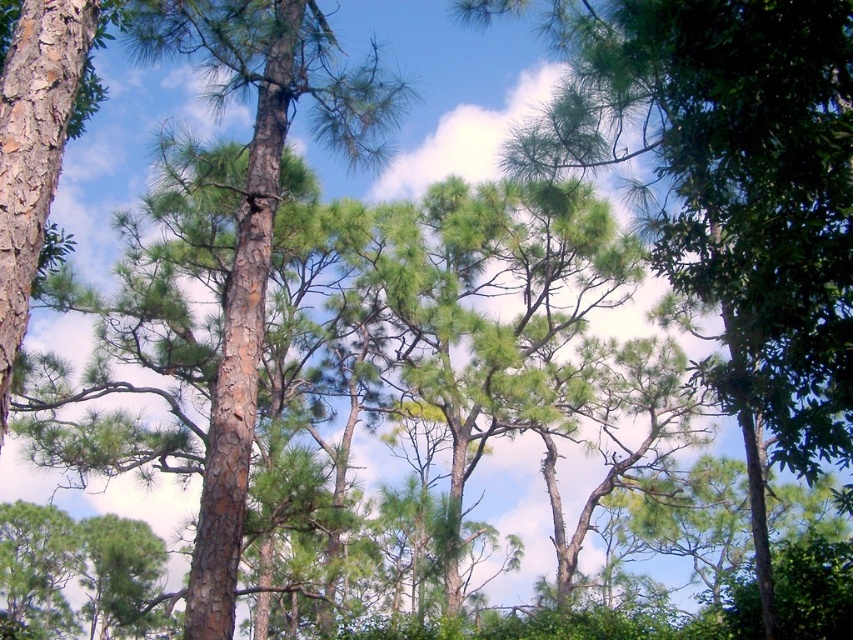
Question: Which point is farther from the camera taking this photo?

Choices:
 (A) (814, 129)
 (B) (354, 106)

Answer: (B)

Question: Is green matte tree at center closer to the viewer compared to brown rough bark tree at left?

Choices:
 (A) yes
 (B) no

Answer: (A)

Question: Can you confirm if green matte tree at center is positioned to the right of brown rough bark tree at left?

Choices:
 (A) no
 (B) yes

Answer: (B)

Question: Does green matte tree at center have a greater width compared to brown rough bark tree at left?

Choices:
 (A) no
 (B) yes

Answer: (B)

Question: Which point is closer to the camera?

Choices:
 (A) (492, 4)
 (B) (271, 147)

Answer: (B)